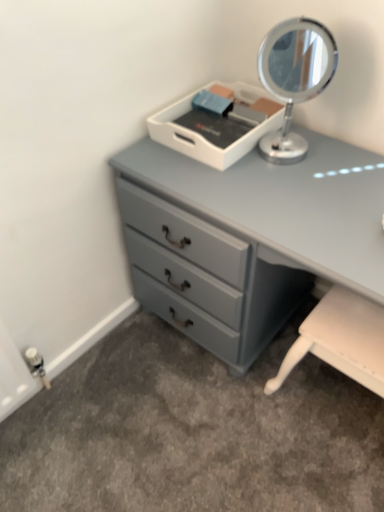
This screenshot has width=384, height=512. What do you see at coordinates (262, 223) in the screenshot?
I see `matte gray dresser at center` at bounding box center [262, 223].

At what (x,y) coordinates should I click in order to perform the action: click on matte gray dresser at center. Please return your answer as a coordinate pair (x, y). This screenshot has width=384, height=512. Looking at the image, I should click on (262, 223).

Locate an element on the screen. This screenshot has height=512, width=384. silver metallic mirror at upper right is located at coordinates (294, 78).

Describe the element at coordinates (294, 78) in the screenshot. I see `silver metallic mirror at upper right` at that location.

Identify the location of matte gray dresser at center. The image size is (384, 512). (262, 223).

Is matte gray dresser at center at the right side of silver metallic mirror at upper right?

Yes.

Which object is more forward, matte gray dresser at center or silver metallic mirror at upper right?

matte gray dresser at center is more forward.

Considering the points (348, 166) and (272, 70), which point is in front, point (348, 166) or point (272, 70)?

The point (272, 70) is closer to the camera.

From the image's perspective, which one is positioned lower, matte gray dresser at center or silver metallic mirror at upper right?

matte gray dresser at center appears lower in the image.

From a real-world perspective, between matte gray dresser at center and silver metallic mirror at upper right, who is vertically higher?

silver metallic mirror at upper right, from a real-world perspective.

In the scene shown: Considering the sizes of matte gray dresser at center and silver metallic mirror at upper right in the image, is matte gray dresser at center wider or thinner than silver metallic mirror at upper right?

In the image, matte gray dresser at center appears to be wider than silver metallic mirror at upper right.

In terms of height, does matte gray dresser at center look taller or shorter compared to silver metallic mirror at upper right?

Clearly, matte gray dresser at center is taller compared to silver metallic mirror at upper right.

Can you confirm if matte gray dresser at center is smaller than silver metallic mirror at upper right?

Incorrect, matte gray dresser at center is not smaller in size than silver metallic mirror at upper right.

Is matte gray dresser at center outside of silver metallic mirror at upper right?

Indeed, matte gray dresser at center is completely outside silver metallic mirror at upper right.

Is matte gray dresser at center beside silver metallic mirror at upper right?

No, matte gray dresser at center is not in contact with silver metallic mirror at upper right.

Is matte gray dresser at center facing away from silver metallic mirror at upper right?

No, matte gray dresser at center is not facing the opposite direction of silver metallic mirror at upper right.

Where is `table lamp that appears on the left of matte gray dresser at center`? table lamp that appears on the left of matte gray dresser at center is located at coordinates (294, 78).

Between silver metallic mirror at upper right and matte gray dresser at center, which one appears on the right side from the viewer's perspective?

matte gray dresser at center is more to the right.

Considering the relative positions of silver metallic mirror at upper right and matte gray dresser at center in the image provided, is silver metallic mirror at upper right behind matte gray dresser at center?

Yes, silver metallic mirror at upper right is behind matte gray dresser at center.

Does point (283, 53) come closer to viewer compared to point (258, 329)?

Yes, it is.

From the image's perspective, would you say silver metallic mirror at upper right is shown under matte gray dresser at center?

Incorrect, from the image's perspective, silver metallic mirror at upper right is higher than matte gray dresser at center.

From a real-world perspective, does silver metallic mirror at upper right stand above matte gray dresser at center?

Yes, from a real-world perspective, silver metallic mirror at upper right is over matte gray dresser at center

Is silver metallic mirror at upper right wider or thinner than matte gray dresser at center?

silver metallic mirror at upper right is thinner than matte gray dresser at center.

Who is taller, silver metallic mirror at upper right or matte gray dresser at center?

With more height is matte gray dresser at center.

In terms of size, does silver metallic mirror at upper right appear bigger or smaller than matte gray dresser at center?

silver metallic mirror at upper right is smaller than matte gray dresser at center.

Is silver metallic mirror at upper right inside the boundaries of matte gray dresser at center, or outside?

silver metallic mirror at upper right is not enclosed by matte gray dresser at center.

Would you say silver metallic mirror at upper right is a long distance from matte gray dresser at center?

silver metallic mirror at upper right is actually quite close to matte gray dresser at center.

Is silver metallic mirror at upper right looking in the opposite direction of matte gray dresser at center?

No, matte gray dresser at center is not at the back of silver metallic mirror at upper right.

What's the angular difference between silver metallic mirror at upper right and matte gray dresser at center's facing directions?

silver metallic mirror at upper right and matte gray dresser at center are facing 32.6 degrees away from each other.

The image size is (384, 512). Identify the location of the chest of drawers directly beneath the silver metallic mirror at upper right (from a real-world perspective). (262, 223).

Identify the location of table lamp lying on the left of matte gray dresser at center. The image size is (384, 512). point(294,78).

The height and width of the screenshot is (512, 384). In order to click on table lamp above the matte gray dresser at center (from the image's perspective) in this screenshot , I will do `click(294, 78)`.